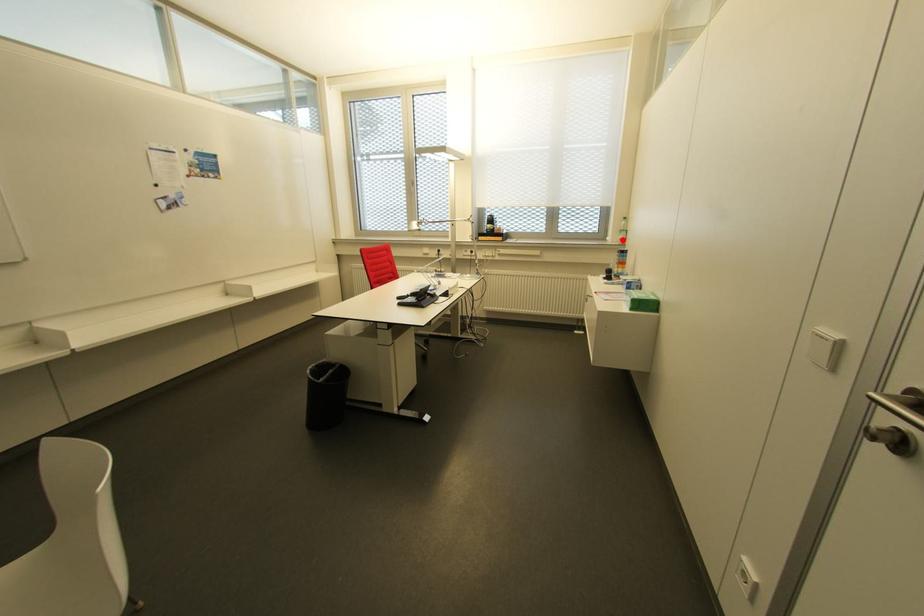
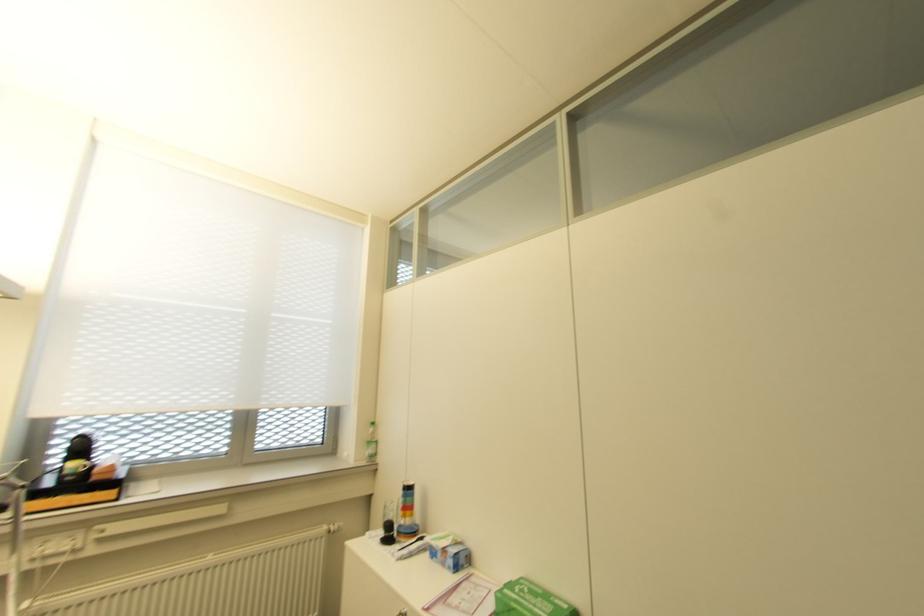
Question: I am providing you with two images of the same scene from different viewpoints. Given a red point in image1, look at the same physical point in image2. Is it:

Choices:
 (A) Closer to the viewpoint
 (B) Farther from the viewpoint

Answer: (B)